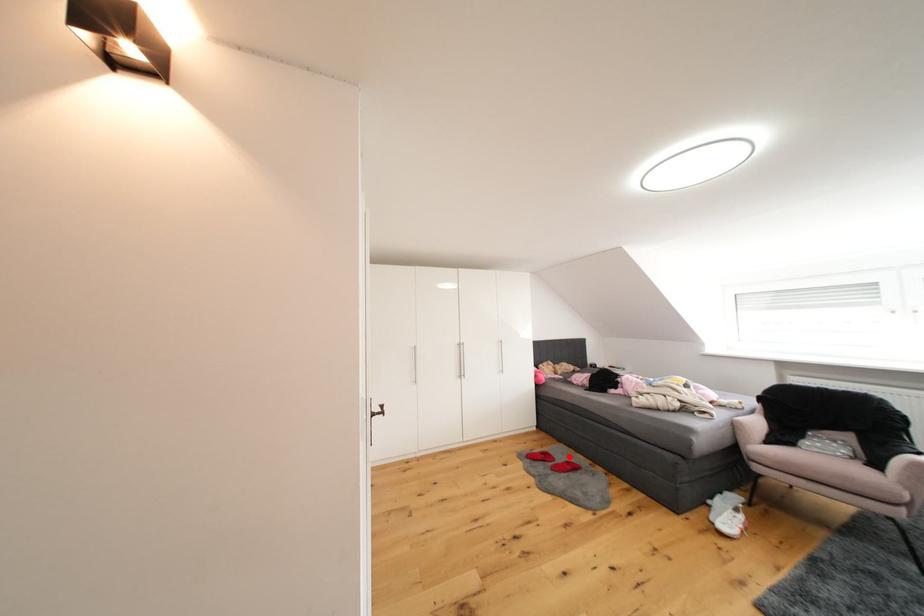
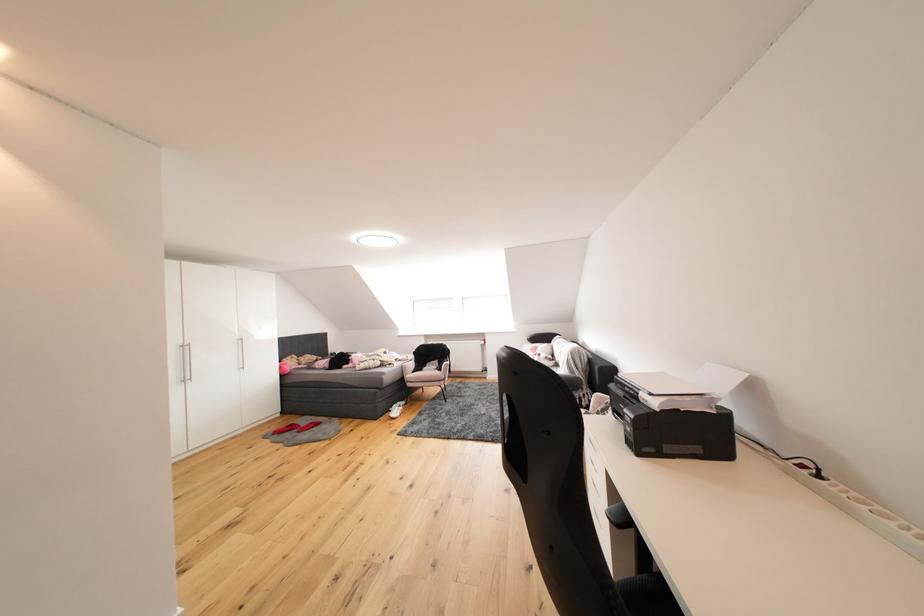
Find the pixel in the second image that matches the highlighted location in the first image.

(313, 424)